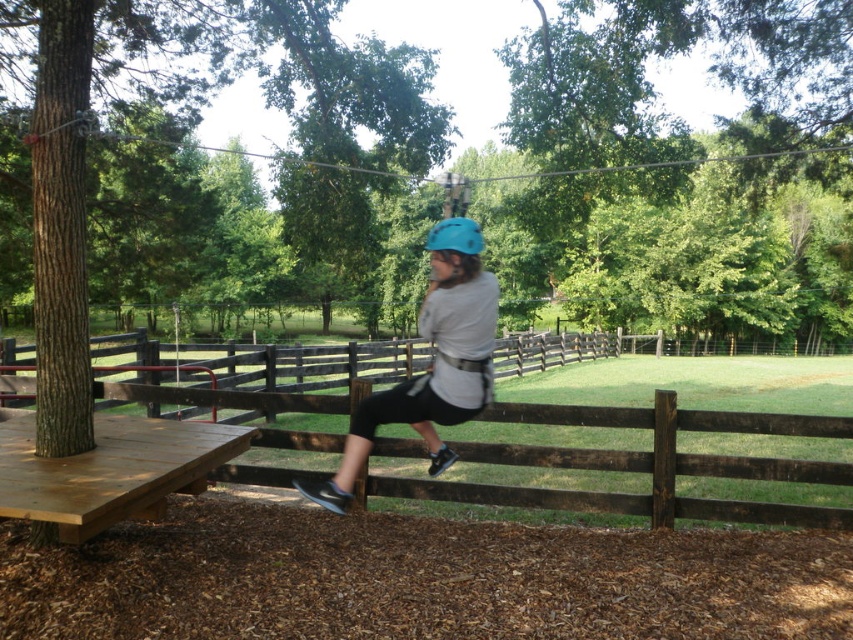
Between light brown wooden picnic table at lower left and matte blue helmet at center, which one appears on the right side from the viewer's perspective?

From the viewer's perspective, matte blue helmet at center appears more on the right side.

Is light brown wooden picnic table at lower left below matte blue helmet at center?

A: Yes, light brown wooden picnic table at lower left is below matte blue helmet at center.

This screenshot has height=640, width=853. What do you see at coordinates (109, 470) in the screenshot?
I see `light brown wooden picnic table at lower left` at bounding box center [109, 470].

What are the coordinates of `light brown wooden picnic table at lower left` in the screenshot? It's located at (109, 470).

Which of these two, brown wooden fence at center or matte blue helmet at center, stands taller?

Standing taller between the two is matte blue helmet at center.

Does brown wooden fence at center have a larger size compared to matte blue helmet at center?

Actually, brown wooden fence at center might be smaller than matte blue helmet at center.

The image size is (853, 640). What do you see at coordinates (643, 464) in the screenshot? I see `brown wooden fence at center` at bounding box center [643, 464].

Locate an element on the screen. brown wooden fence at center is located at coordinates (643, 464).

Which is behind, point (689, 468) or point (160, 438)?

The point (689, 468) is more distant.

How far apart are brown wooden fence at center and light brown wooden picnic table at lower left?

brown wooden fence at center and light brown wooden picnic table at lower left are 4.04 meters apart from each other.

Based on the photo, who is more distant from viewer, (x=669, y=461) or (x=131, y=516)?

Point (x=669, y=461)

Locate an element on the screen. This screenshot has width=853, height=640. brown wooden fence at center is located at coordinates (643, 464).